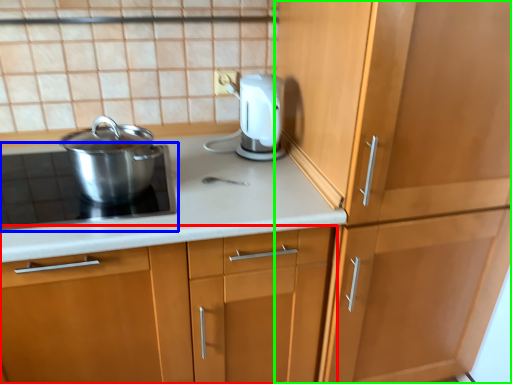
Question: Estimate the real-world distances between objects in this image. Which object is farther from cabinetry (highlighted by a red box), home appliance (highlighted by a blue box) or cabinetry (highlighted by a green box)?

Choices:
 (A) home appliance
 (B) cabinetry

Answer: (B)